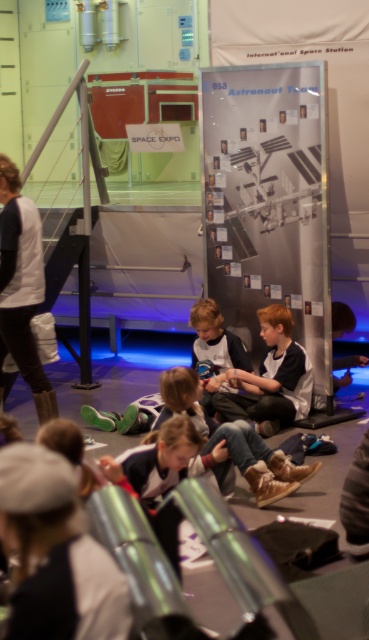
Based on the photo, who is taller, matte black jacket at center or light brown hair at center?

With more height is matte black jacket at center.

Is point (277, 332) in front of point (205, 305)?

Yes, it is in front of point (205, 305).

Identify the location of matte black jacket at center. (270, 378).